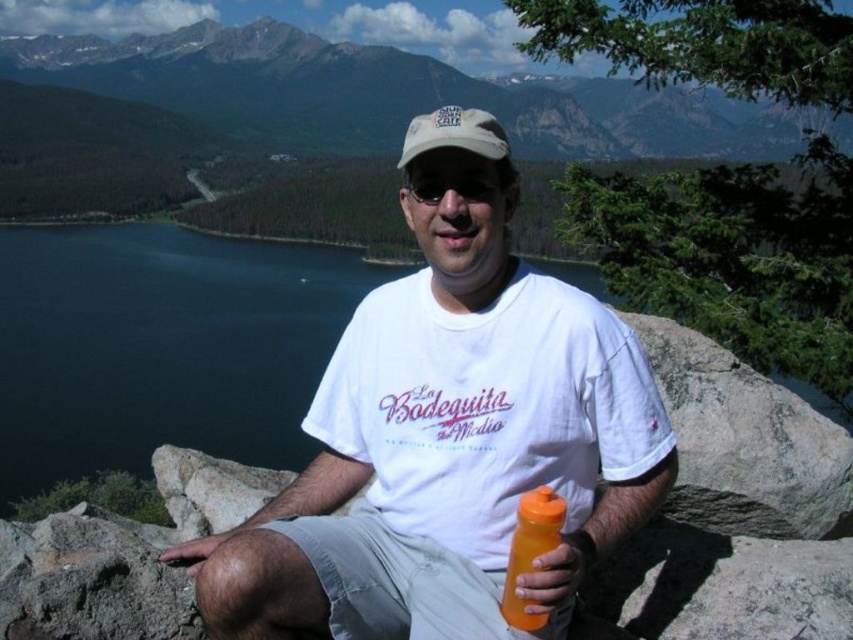
Looking at this image, you are a hiker planning to take a photo of the rocky mountain range at upper center and the white fabric cap at center. Which object should you focus on first if you want to capture both in a single shot without moving the camera?

You should focus on the rocky mountain range at upper center first because it is much taller than the white fabric cap at center, so it will occupy more of the frame and ensure both are visible.